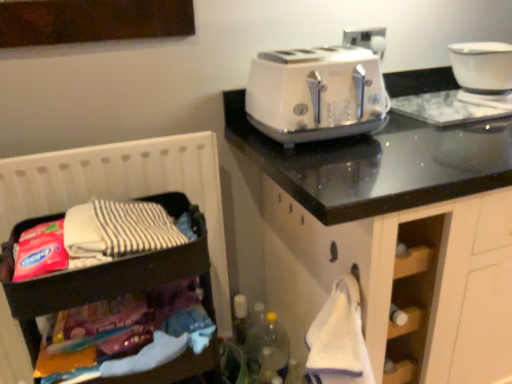
The width and height of the screenshot is (512, 384). Identify the location of wooden dark brown storage at left. (124, 188).

Is white glossy bowl at upper right shorter than white glossy toaster at upper right?

Yes.

From the picture: Can you confirm if white glossy bowl at upper right is bigger than white glossy toaster at upper right?

Incorrect, white glossy bowl at upper right is not larger than white glossy toaster at upper right.

Is point (490, 89) closer to viewer compared to point (274, 92)?

No, (490, 89) is further to viewer.

From the picture: Considering the relative sizes of wooden dark brown storage at left and white glossy toaster at upper right in the image provided, is wooden dark brown storage at left bigger than white glossy toaster at upper right?

Yes, wooden dark brown storage at left is bigger than white glossy toaster at upper right.

Looking at their sizes, would you say wooden dark brown storage at left is wider or thinner than white glossy toaster at upper right?

Considering their sizes, wooden dark brown storage at left looks slimmer than white glossy toaster at upper right.

From a real-world perspective, is wooden dark brown storage at left on top of white glossy toaster at upper right?

Actually, wooden dark brown storage at left is physically below white glossy toaster at upper right in the real world.

Find the location of a particular element. The image size is (512, 384). infant bed on the left of white glossy toaster at upper right is located at coordinates (124, 188).

Are white glossy toaster at upper right and white glossy bowl at upper right far apart?

No.

Is white glossy toaster at upper right located outside white glossy bowl at upper right?

That's correct, white glossy toaster at upper right is outside of white glossy bowl at upper right.

From the image's perspective, who appears lower, white glossy toaster at upper right or white glossy bowl at upper right?

From the image's view, white glossy toaster at upper right is below.

Which is in front, white glossy toaster at upper right or white glossy bowl at upper right?

white glossy toaster at upper right is in front.

Does white glossy bowl at upper right have a smaller size compared to wooden dark brown storage at left?

Yes, white glossy bowl at upper right is smaller than wooden dark brown storage at left.

Is wooden dark brown storage at left inside white glossy bowl at upper right?

No, wooden dark brown storage at left is not inside white glossy bowl at upper right.

Considering the relative sizes of white glossy bowl at upper right and wooden dark brown storage at left in the image provided, is white glossy bowl at upper right wider than wooden dark brown storage at left?

Indeed, white glossy bowl at upper right has a greater width compared to wooden dark brown storage at left.

Identify the location of home appliance above the wooden dark brown storage at left (from a real-world perspective). (483, 72).

Identify the location of infant bed that is under the white glossy bowl at upper right (from a real-world perspective). (124, 188).

Consider the image. From the image's perspective, is wooden dark brown storage at left on top of white glossy bowl at upper right?

No, from the image's perspective, wooden dark brown storage at left is not on top of white glossy bowl at upper right.

Is wooden dark brown storage at left at the right side of white glossy bowl at upper right?

No.

Between white glossy toaster at upper right and wooden dark brown storage at left, which one has larger size?

wooden dark brown storage at left is bigger.

How different are the orientations of white glossy toaster at upper right and wooden dark brown storage at left in degrees?

white glossy toaster at upper right and wooden dark brown storage at left are facing 2.11 degrees away from each other.

Is wooden dark brown storage at left located within white glossy toaster at upper right?

No, white glossy toaster at upper right does not contain wooden dark brown storage at left.

Find the location of a particular element. infant bed below the white glossy toaster at upper right (from the image's perspective) is located at coordinates (124, 188).

Find the location of a particular element. This screenshot has height=384, width=512. home appliance positioned vertically above the white glossy toaster at upper right (from a real-world perspective) is located at coordinates (483, 72).

At what (x,y) coordinates should I click in order to perform the action: click on toaster behind the wooden dark brown storage at left. Please return your answer as a coordinate pair (x, y). This screenshot has height=384, width=512. Looking at the image, I should click on (316, 94).

Based on their spatial positions, is white glossy toaster at upper right or white glossy bowl at upper right further from wooden dark brown storage at left?

white glossy bowl at upper right is positioned further to the anchor wooden dark brown storage at left.

From the image, which object appears to be nearer to wooden dark brown storage at left, white glossy bowl at upper right or white glossy toaster at upper right?

white glossy toaster at upper right is positioned closer to the anchor wooden dark brown storage at left.

When comparing their distances from white glossy toaster at upper right, does wooden dark brown storage at left or white glossy bowl at upper right seem further?

white glossy bowl at upper right is positioned further to the anchor white glossy toaster at upper right.

Which object lies nearer to the anchor point white glossy bowl at upper right, white glossy toaster at upper right or wooden dark brown storage at left?

The object closer to white glossy bowl at upper right is white glossy toaster at upper right.

From the picture: When comparing their distances from white glossy toaster at upper right, does white glossy bowl at upper right or wooden dark brown storage at left seem closer?

Among the two, wooden dark brown storage at left is located nearer to white glossy toaster at upper right.

Estimate the real-world distances between objects in this image. Which object is closer to white glossy bowl at upper right, wooden dark brown storage at left or white glossy toaster at upper right?

white glossy toaster at upper right.

Image resolution: width=512 pixels, height=384 pixels. I want to click on toaster located between wooden dark brown storage at left and white glossy bowl at upper right in the left-right direction, so click(x=316, y=94).